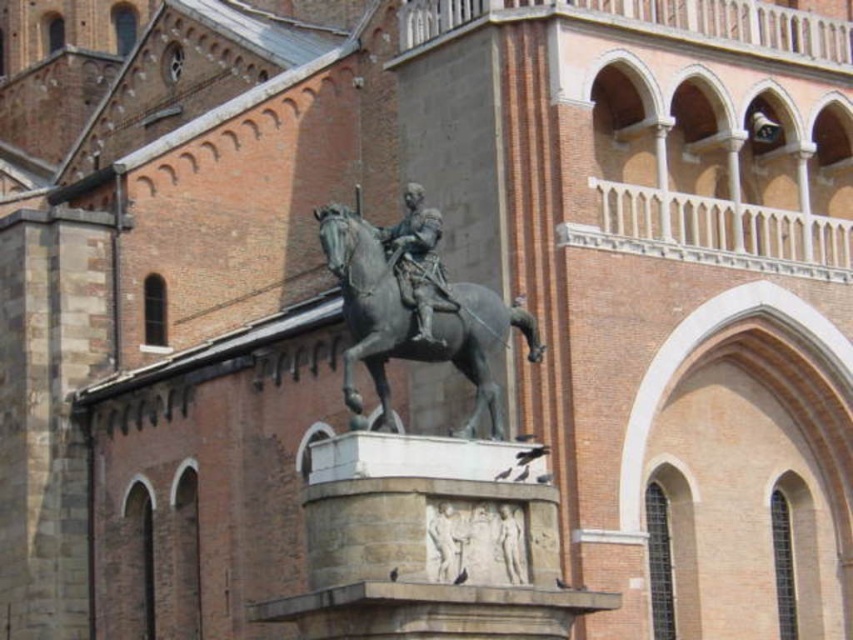
This screenshot has width=853, height=640. What do you see at coordinates (415, 321) in the screenshot? I see `bronze statue of horse at center` at bounding box center [415, 321].

Is bronze statue of horse at center below polished bronze statue at center?

Correct, bronze statue of horse at center is located below polished bronze statue at center.

I want to click on bronze statue of horse at center, so click(x=415, y=321).